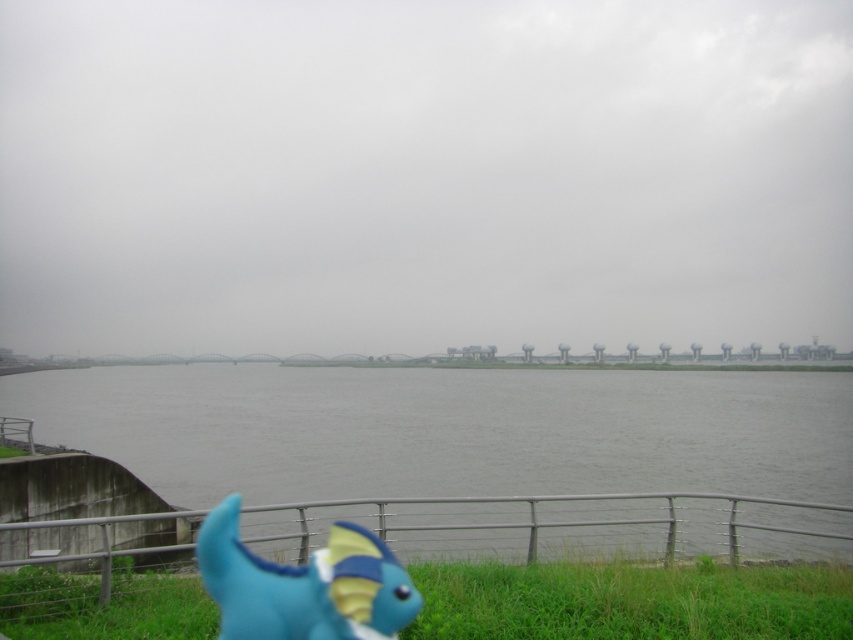
You are standing on the embankment near the metal railing and want to walk towards the gray concrete lake at center. However, you notice the green grass at lower center in your path. Based on their sizes, which area will you have to navigate around more carefully?

The gray concrete lake at center has a larger size compared to green grass at lower center, so you will need to navigate around the gray concrete lake at center more carefully due to its greater size.